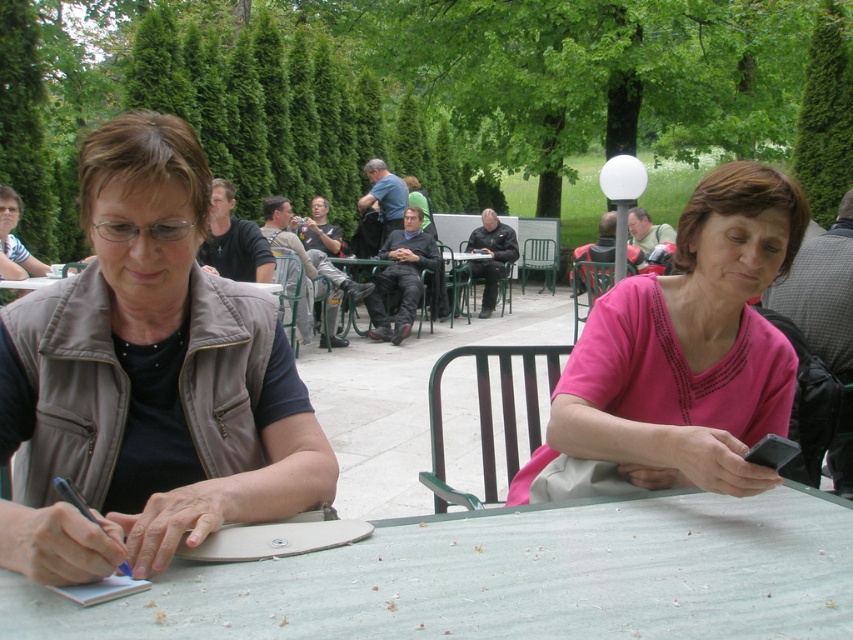
Question: Does light brown leather jacket at center have a smaller size compared to blue denim shirt at center?

Choices:
 (A) no
 (B) yes

Answer: (A)

Question: Can you confirm if gray checkered shirt at center is bigger than green metal table at center?

Choices:
 (A) no
 (B) yes

Answer: (A)

Question: Among these points, which one is farthest from the camera?

Choices:
 (A) (639, 250)
 (B) (808, 291)

Answer: (A)

Question: Which object is farther from the camera taking this photo?

Choices:
 (A) matte brown vest at center
 (B) blue denim shirt at center
 (C) gray checkered shirt at center

Answer: (B)

Question: Based on their relative distances, which object is nearer to the black leather jacket at center?

Choices:
 (A) pink fabric shirt at center
 (B) white textured table at center

Answer: (A)

Question: Can you confirm if dark gray suit at center is positioned below black matte shirt at center?

Choices:
 (A) no
 (B) yes

Answer: (B)